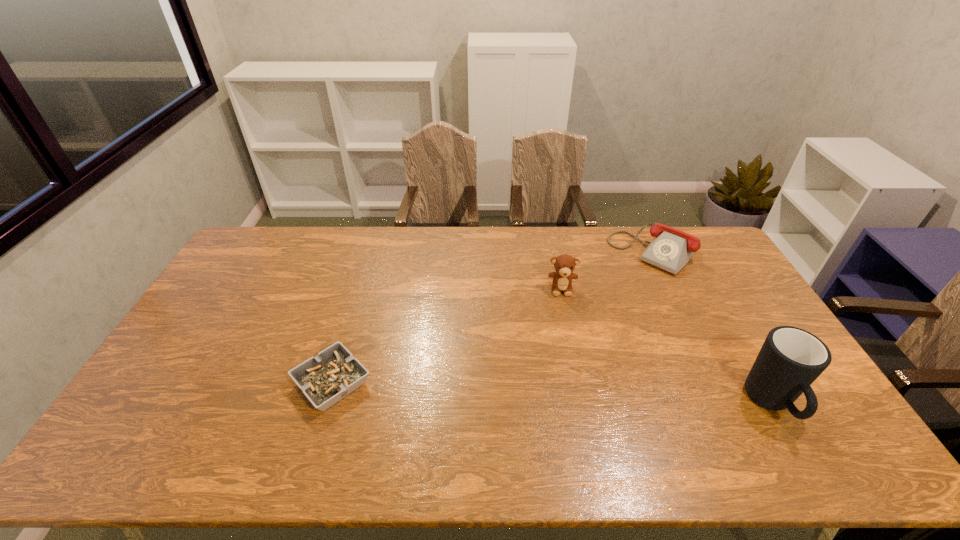
What are the coordinates of `the leftmost object` in the screenshot? It's located at (334, 373).

Locate an element on the screen. The width and height of the screenshot is (960, 540). the shortest object is located at coordinates (334, 373).

What are the coordinates of `mug` in the screenshot? It's located at (791, 359).

Image resolution: width=960 pixels, height=540 pixels. I want to click on the third shortest object, so click(x=564, y=264).

Identify the location of the third nearest object. (564, 264).

The height and width of the screenshot is (540, 960). Identify the location of the farthest object. (671, 249).

The image size is (960, 540). I want to click on telephone, so click(x=671, y=249).

Where is `free space located 0.170m on the back of the leftmost object`? Image resolution: width=960 pixels, height=540 pixels. free space located 0.170m on the back of the leftmost object is located at coordinates (354, 310).

Find the location of a particular element. This screenshot has width=960, height=540. free spot located 0.100m on the face of the teddy bear is located at coordinates (564, 319).

Find the location of `vacant space located 0.210m on the face of the teddy bear`. vacant space located 0.210m on the face of the teddy bear is located at coordinates (565, 346).